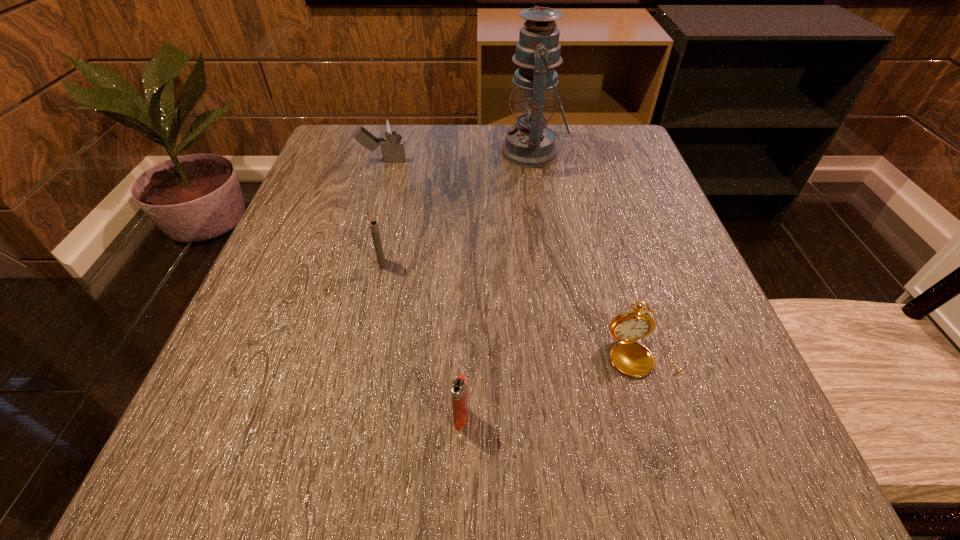
Where is `blank area located 0.390m on the right of the third nearest object`? The image size is (960, 540). blank area located 0.390m on the right of the third nearest object is located at coordinates (612, 263).

Find the location of `free space located on the left of the nearest object`. free space located on the left of the nearest object is located at coordinates (313, 418).

Image resolution: width=960 pixels, height=540 pixels. I want to click on free region located 0.130m on the face of the pocket watch, so click(x=681, y=476).

Locate an element on the screen. lantern that is at the far edge is located at coordinates (530, 143).

At what (x,y) coordinates should I click in order to perform the action: click on igniter positioned at the far edge. Please return your answer as a coordinate pair (x, y). The height and width of the screenshot is (540, 960). Looking at the image, I should click on pos(389,127).

Where is `object that is at the left edge`? object that is at the left edge is located at coordinates (389, 127).

Find the location of a particular element. object that is at the right edge is located at coordinates (631, 358).

This screenshot has height=540, width=960. I want to click on object that is at the far left corner, so click(x=389, y=127).

The height and width of the screenshot is (540, 960). I want to click on vacant space at the far edge of the desktop, so click(391, 162).

This screenshot has width=960, height=540. In the image, there is a desktop. What are the coordinates of `vacant space at the near edge` in the screenshot? It's located at (568, 476).